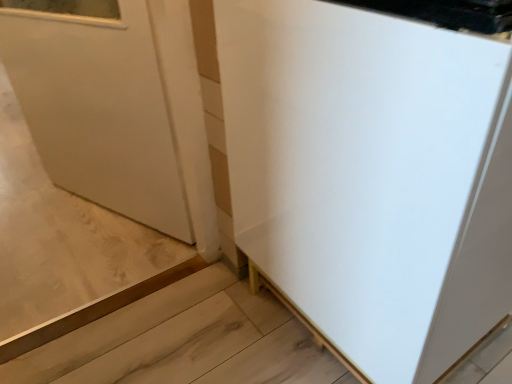
Question: Should I look upward or downward to see white matte cabinet at center?

Choices:
 (A) up
 (B) down

Answer: (A)